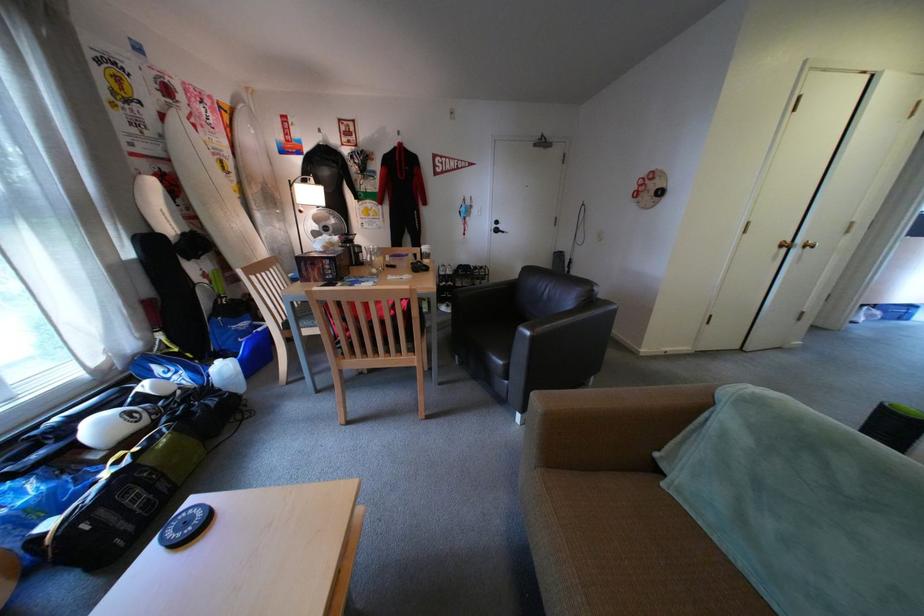
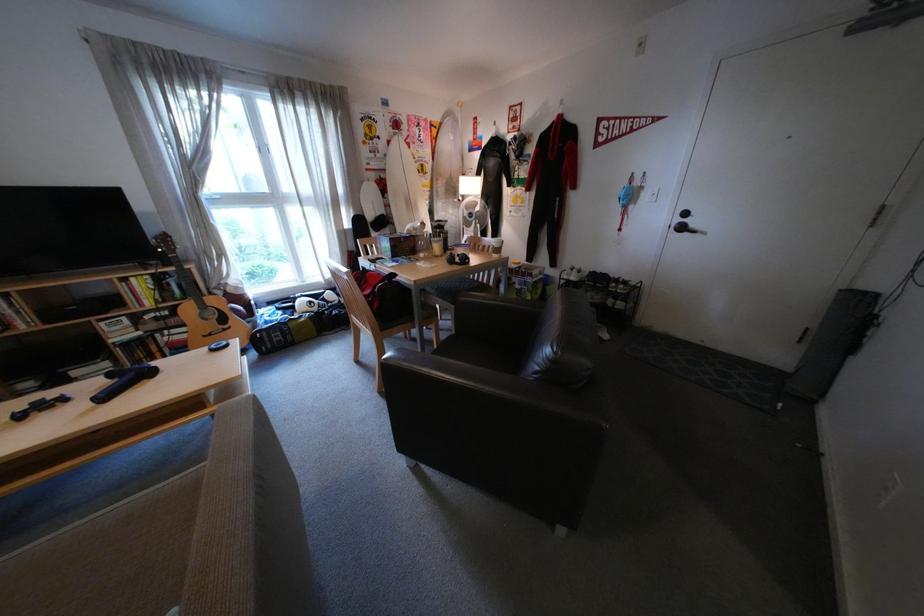
Find the pixel in the second image that matches point (511, 232) in the first image.

(696, 229)